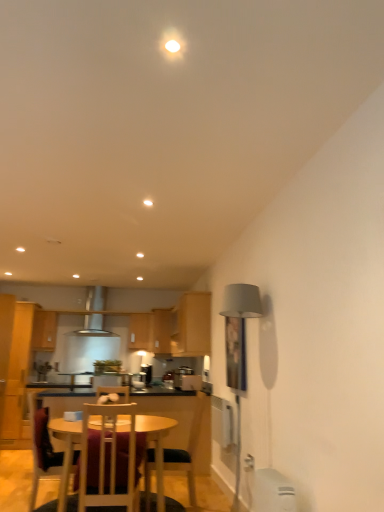
Question: Is wooden chair at center, marked as the third chair in a left-to-right arrangement, a part of wooden chair at lower left, the first chair from the left?

Choices:
 (A) no
 (B) yes

Answer: (A)

Question: Is wooden chair at lower left, the first chair from the left, aimed at wooden chair at center, marked as the third chair in a left-to-right arrangement?

Choices:
 (A) no
 (B) yes

Answer: (B)

Question: Does wooden chair at lower left, the 3th chair positioned from the right, have a lesser height compared to wooden chair at center, marked as the third chair in a left-to-right arrangement?

Choices:
 (A) yes
 (B) no

Answer: (B)

Question: Does wooden chair at lower left, the 3th chair positioned from the right, lie behind wooden chair at center, marked as the third chair in a left-to-right arrangement?

Choices:
 (A) yes
 (B) no

Answer: (B)

Question: Is wooden chair at lower left, the first chair from the left, located outside wooden chair at center, marked as the third chair in a left-to-right arrangement?

Choices:
 (A) no
 (B) yes

Answer: (B)

Question: Considering the positions of wooden cabinet at upper left, which appears as the 1th cabinetry when viewed from the left, and wooden table at center in the image, is wooden cabinet at upper left, which appears as the 1th cabinetry when viewed from the left, bigger or smaller than wooden table at center?

Choices:
 (A) small
 (B) big

Answer: (A)

Question: In terms of height, does wooden cabinet at upper left, the 4th cabinetry from the right, look taller or shorter compared to wooden table at center?

Choices:
 (A) tall
 (B) short

Answer: (B)

Question: Considering their positions, is wooden cabinet at upper left, which appears as the 1th cabinetry when viewed from the left, located in front of or behind wooden table at center?

Choices:
 (A) front
 (B) behind

Answer: (B)

Question: From the image's perspective, is wooden cabinet at upper left, marked as the 3th cabinetry in a back-to-front arrangement, located above or below wooden table at center?

Choices:
 (A) above
 (B) below

Answer: (A)

Question: Based on their sizes in the image, would you say wooden chair at center, marked as the third chair in a left-to-right arrangement, is bigger or smaller than wooden chair at center, the second chair viewed from the right?

Choices:
 (A) small
 (B) big

Answer: (B)

Question: Is wooden chair at center, marked as the third chair in a left-to-right arrangement, situated inside wooden chair at center, positioned as the second chair in left-to-right order, or outside?

Choices:
 (A) inside
 (B) outside

Answer: (B)

Question: From their relative heights in the image, would you say wooden chair at center, which is the 1th chair in right-to-left order, is taller or shorter than wooden chair at center, positioned as the second chair in left-to-right order?

Choices:
 (A) tall
 (B) short

Answer: (A)

Question: In the image, is wooden chair at center, marked as the third chair in a left-to-right arrangement, positioned in front of or behind wooden chair at center, positioned as the second chair in left-to-right order?

Choices:
 (A) behind
 (B) front

Answer: (A)

Question: Is wooden cabinet at center, the 3th cabinetry in the left-to-right sequence, situated inside wooden cabinet at upper left, the 4th cabinetry from the right, or outside?

Choices:
 (A) outside
 (B) inside

Answer: (A)

Question: Is wooden cabinet at center, which appears as the second cabinetry when viewed from the right, in front of or behind wooden cabinet at upper left, marked as the 3th cabinetry in a back-to-front arrangement, in the image?

Choices:
 (A) behind
 (B) front

Answer: (A)